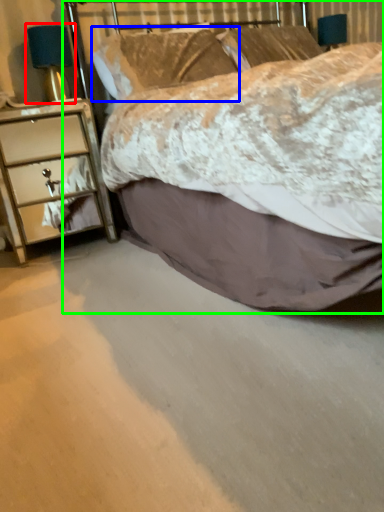
Question: Considering the real-world distances, which object is closest to bedside lamp (highlighted by a red box)? pillow (highlighted by a blue box) or bed (highlighted by a green box).

Choices:
 (A) pillow
 (B) bed

Answer: (A)